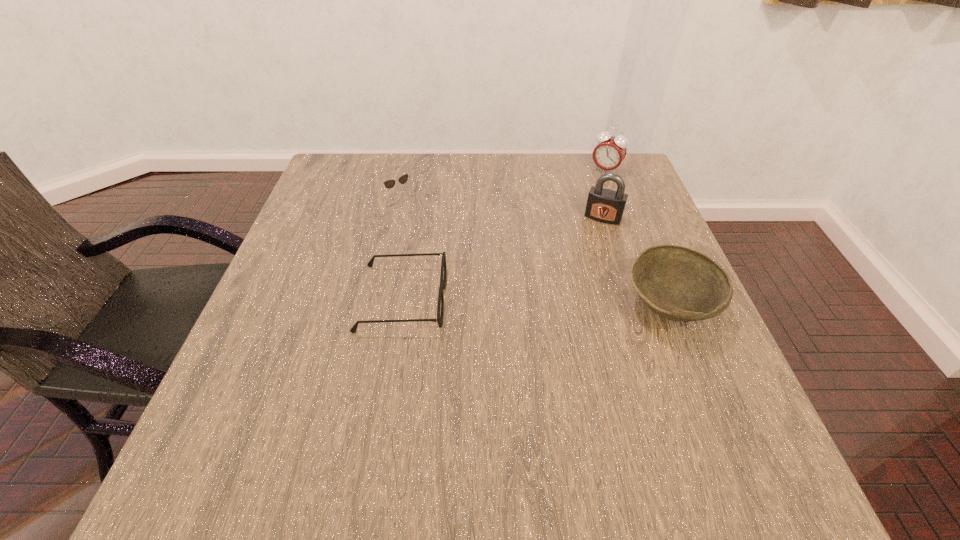
Identify the location of vacant space located 0.240m on the clock face of the farthest object. This screenshot has width=960, height=540. (568, 222).

Find the location of a particular element. free space located on the clock face of the farthest object is located at coordinates (588, 194).

Where is `vacant space located 0.110m on the clock face of the farthest object`? This screenshot has width=960, height=540. vacant space located 0.110m on the clock face of the farthest object is located at coordinates (587, 196).

Identify the location of free spot located on the front of the padlock near the keyhole. (577, 274).

Identify the location of vacant region located 0.270m on the front of the padlock near the keyhole. The image size is (960, 540). (566, 299).

You are a GUI agent. You are given a task and a screenshot of the screen. Output one action in this format:
    pyautogui.click(x=<x>, y=<y>)
    Task: Click on the vacant space located 0.170m on the front of the padlock near the keyhole
    The height and width of the screenshot is (540, 960).
    Given the screenshot: What is the action you would take?
    pyautogui.click(x=580, y=268)

What are the coordinates of `sunglasses positioned at the far edge` in the screenshot? It's located at (389, 184).

Where is `alarm clock positioned at the far edge`? alarm clock positioned at the far edge is located at coordinates (609, 153).

Identify the location of object at the left edge. Image resolution: width=960 pixels, height=540 pixels. (389, 184).

I want to click on bowl that is at the right edge, so click(677, 283).